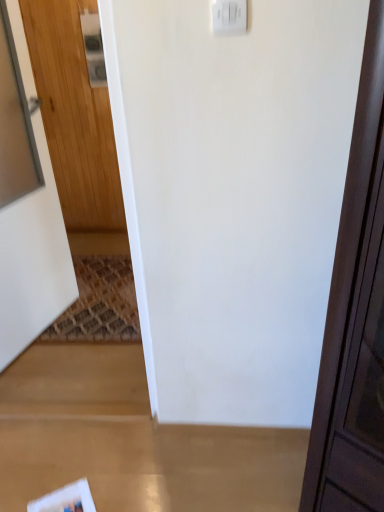
Identify the location of white glossy magazine at lower left. (66, 499).

Find the location of a particular element. The image size is (384, 512). white plastic light switch at upper center, arranged as the first light switch when viewed from the right is located at coordinates (229, 17).

Where is `wooden door at left`? The width and height of the screenshot is (384, 512). wooden door at left is located at coordinates (33, 261).

From a real-world perspective, who is located higher, white plastic light switch at upper center, the 1th light switch in the bottom-to-top sequence, or white plastic light switch at upper center, placed as the first light switch when sorted from back to front?

white plastic light switch at upper center, the 1th light switch in the bottom-to-top sequence.

Is white plastic light switch at upper center, the 1th light switch in the bottom-to-top sequence, taller than white plastic light switch at upper center, the 2th light switch positioned from the right?

In fact, white plastic light switch at upper center, the 1th light switch in the bottom-to-top sequence, may be shorter than white plastic light switch at upper center, the 2th light switch positioned from the right.

From the image's perspective, relative to white plastic light switch at upper center, which appears as the 2th light switch when ordered from the bottom, is white plastic light switch at upper center, which ranks as the second light switch in top-to-bottom order, above or below?

Based on their image positions, white plastic light switch at upper center, which ranks as the second light switch in top-to-bottom order, is located beneath white plastic light switch at upper center, which appears as the 2th light switch when ordered from the bottom.

Can we say white plastic light switch at upper center, the first light switch from the top, lies outside wooden door at left?

white plastic light switch at upper center, the first light switch from the top, is positioned outside wooden door at left.

From the image's perspective, is white plastic light switch at upper center, which appears as the 2th light switch when ordered from the bottom, above or below wooden door at left?

Based on their image positions, white plastic light switch at upper center, which appears as the 2th light switch when ordered from the bottom, is located above wooden door at left.

Considering the relative sizes of white plastic light switch at upper center, the second light switch from the left, and white glossy magazine at lower left in the image provided, is white plastic light switch at upper center, the second light switch from the left, wider than white glossy magazine at lower left?

No.

Would you say white plastic light switch at upper center, which ranks as the second light switch in top-to-bottom order, is to the left or to the right of white glossy magazine at lower left in the picture?

Based on their positions, white plastic light switch at upper center, which ranks as the second light switch in top-to-bottom order, is located to the right of white glossy magazine at lower left.

Would you say white glossy magazine at lower left is part of white plastic light switch at upper center, the 2th light switch in the back-to-front sequence,'s contents?

No, white glossy magazine at lower left is not surrounded by white plastic light switch at upper center, the 2th light switch in the back-to-front sequence.

Does white plastic light switch at upper center, the 1th light switch in the bottom-to-top sequence, turn towards white glossy magazine at lower left?

No.

Considering the sizes of wooden door at left and white plastic light switch at upper center, arranged as the first light switch when viewed from the right, in the image, is wooden door at left taller or shorter than white plastic light switch at upper center, arranged as the first light switch when viewed from the right,?

Considering their sizes, wooden door at left has more height than white plastic light switch at upper center, arranged as the first light switch when viewed from the right.

From a real-world perspective, is wooden door at left above or below white plastic light switch at upper center, which ranks as the second light switch in top-to-bottom order?

In terms of real-world spatial position, wooden door at left is below white plastic light switch at upper center, which ranks as the second light switch in top-to-bottom order.

Which is behind, point (19, 56) or point (223, 25)?

The point (19, 56) is farther.

Considering the sizes of wooden door at left and white plastic light switch at upper center, which ranks as the second light switch in top-to-bottom order, in the image, is wooden door at left bigger or smaller than white plastic light switch at upper center, which ranks as the second light switch in top-to-bottom order,?

In the image, wooden door at left appears to be larger than white plastic light switch at upper center, which ranks as the second light switch in top-to-bottom order.

From the image's perspective, would you say white glossy magazine at lower left is shown under white plastic light switch at upper center, the first light switch from the top?

Yes, from the image's perspective, white glossy magazine at lower left is beneath white plastic light switch at upper center, the first light switch from the top.

Is point (34, 502) closer or farther from the camera than point (93, 41)?

Point (34, 502) is positioned closer to the camera compared to point (93, 41).

Can you confirm if white glossy magazine at lower left is bigger than white plastic light switch at upper center, positioned as the first light switch in left-to-right order?

Incorrect, white glossy magazine at lower left is not larger than white plastic light switch at upper center, positioned as the first light switch in left-to-right order.

Is white glossy magazine at lower left positioned with its back to white plastic light switch at upper center, placed as the first light switch when sorted from back to front?

No, white glossy magazine at lower left is not facing away from white plastic light switch at upper center, placed as the first light switch when sorted from back to front.

Is white glossy magazine at lower left situated inside white plastic light switch at upper center, the first light switch in the front-to-back sequence, or outside?

white glossy magazine at lower left cannot be found inside white plastic light switch at upper center, the first light switch in the front-to-back sequence.

Is point (87, 510) positioned behind point (222, 25)?

Yes, it is behind point (222, 25).

From the image's perspective, is white glossy magazine at lower left below white plastic light switch at upper center, arranged as the first light switch when viewed from the right?

Yes, from the image's perspective, white glossy magazine at lower left is beneath white plastic light switch at upper center, arranged as the first light switch when viewed from the right.

Does white glossy magazine at lower left come behind white plastic light switch at upper center, the 2th light switch in the back-to-front sequence?

Yes, white glossy magazine at lower left is behind white plastic light switch at upper center, the 2th light switch in the back-to-front sequence.

How many degrees apart are the facing directions of white glossy magazine at lower left and wooden door at left?

44.8 degrees.

From the image's perspective, which one is positioned higher, white glossy magazine at lower left or wooden door at left?

wooden door at left is shown above in the image.

Looking at this image, between white glossy magazine at lower left and wooden door at left, which one has less height?

white glossy magazine at lower left is shorter.

Considering the sizes of objects white glossy magazine at lower left and wooden door at left in the image provided, who is bigger, white glossy magazine at lower left or wooden door at left?

With larger size is wooden door at left.

The height and width of the screenshot is (512, 384). What are the coordinates of `light switch behind the white plastic light switch at upper center, arranged as the first light switch when viewed from the right` in the screenshot? It's located at (93, 48).

Starting from the wooden door at left, which light switch is the 1st one to the right? Please provide its 2D coordinates.

[(93, 48)]

From the image, which object appears to be farther from wooden door at left, white glossy magazine at lower left or white plastic light switch at upper center, the 1th light switch in the bottom-to-top sequence?

white plastic light switch at upper center, the 1th light switch in the bottom-to-top sequence.

When comparing their distances from white glossy magazine at lower left, does white plastic light switch at upper center, the 2th light switch positioned from the right, or white plastic light switch at upper center, arranged as the first light switch when viewed from the right, seem closer?

white plastic light switch at upper center, arranged as the first light switch when viewed from the right.

Based on the photo, which object lies further to the anchor point wooden door at left, white plastic light switch at upper center, arranged as the first light switch when viewed from the right, or white plastic light switch at upper center, which appears as the 2th light switch when ordered from the bottom?

white plastic light switch at upper center, arranged as the first light switch when viewed from the right.

Based on their spatial positions, is white plastic light switch at upper center, which appears as the 2th light switch when ordered from the bottom, or white glossy magazine at lower left closer to wooden door at left?

Among the two, white glossy magazine at lower left is located nearer to wooden door at left.

Looking at the image, which one is located further to white glossy magazine at lower left, white plastic light switch at upper center, the 1th light switch in the bottom-to-top sequence, or white plastic light switch at upper center, which is the 2th light switch from front to back?

white plastic light switch at upper center, which is the 2th light switch from front to back, is further to white glossy magazine at lower left.

Which object lies nearer to the anchor point white glossy magazine at lower left, wooden door at left or white plastic light switch at upper center, the 2th light switch in the back-to-front sequence?

wooden door at left is closer to white glossy magazine at lower left.

From the image, which object appears to be nearer to white plastic light switch at upper center, the 2th light switch positioned from the right, white glossy magazine at lower left or wooden door at left?

wooden door at left is closer to white plastic light switch at upper center, the 2th light switch positioned from the right.

Which object lies nearer to the anchor point white glossy magazine at lower left, white plastic light switch at upper center, which ranks as the second light switch in top-to-bottom order, or wooden door at left?

wooden door at left.

In order to click on light switch between white plastic light switch at upper center, the 2th light switch positioned from the right, and white glossy magazine at lower left in the up-down direction in this screenshot , I will do `click(229, 17)`.

Identify the location of door positioned between white plastic light switch at upper center, the first light switch in the front-to-back sequence, and white plastic light switch at upper center, which appears as the 2th light switch when ordered from the bottom, from near to far. point(33,261).

Identify the location of door between white plastic light switch at upper center, the first light switch from the top, and white glossy magazine at lower left from top to bottom. The height and width of the screenshot is (512, 384). (33, 261).

Locate an element on the screen. The width and height of the screenshot is (384, 512). door between white plastic light switch at upper center, arranged as the first light switch when viewed from the right, and white glossy magazine at lower left vertically is located at coordinates (33, 261).